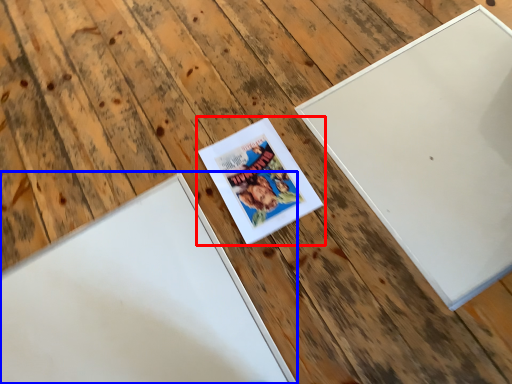
Question: Which of the following is the closest to the observer, picture frame (highlighted by a red box) or picture frame (highlighted by a blue box)?

Choices:
 (A) picture frame
 (B) picture frame

Answer: (B)